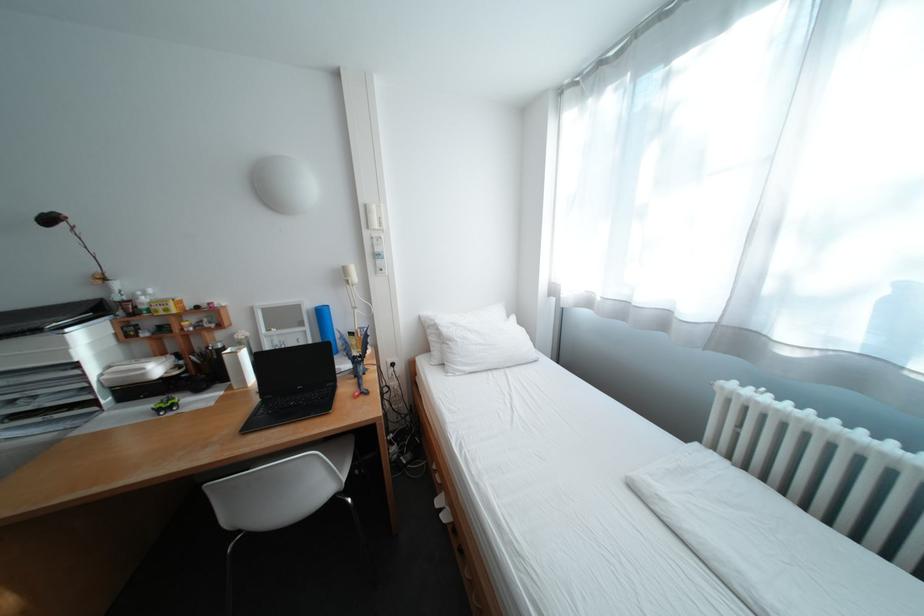
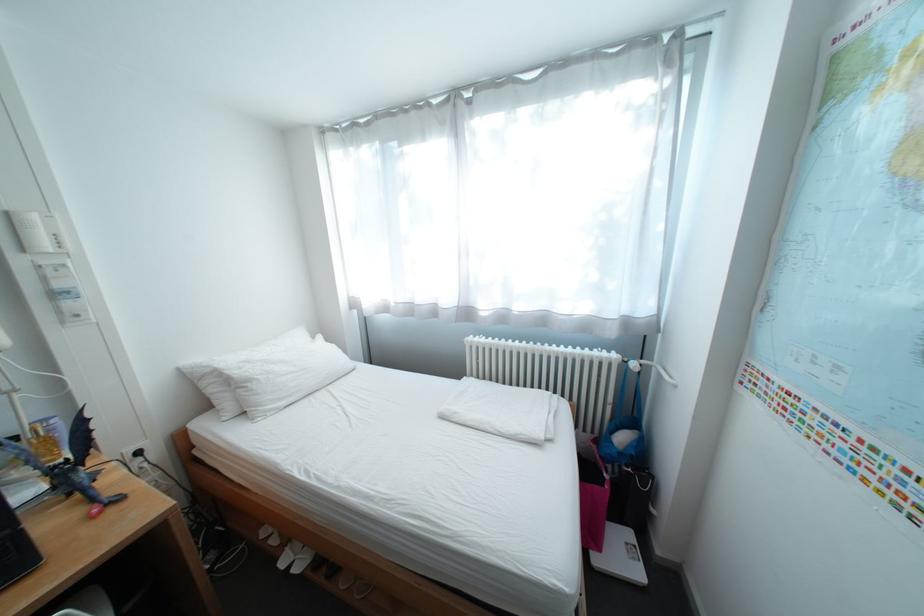
Find the pixel in the second image that matches (367,336) in the first image.

(31, 440)